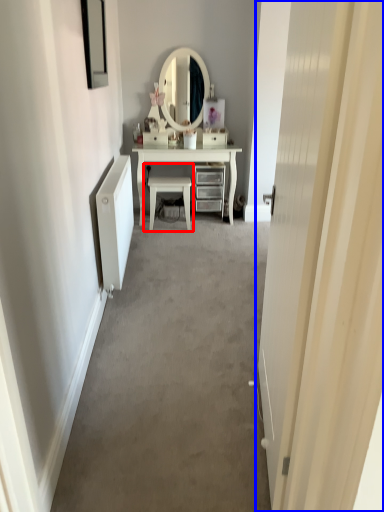
Question: Which object appears closest to the camera in this image, chair (highlighted by a red box) or door (highlighted by a blue box)?

Choices:
 (A) chair
 (B) door

Answer: (B)